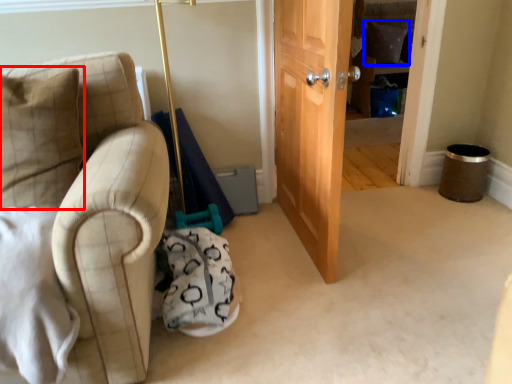
Question: Which object appears closest to the camera in this image, pillow (highlighted by a red box) or pillow (highlighted by a blue box)?

Choices:
 (A) pillow
 (B) pillow

Answer: (A)